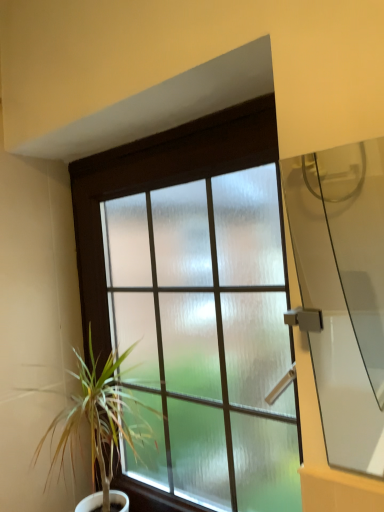
Question: Would you consider green leafy plant at left to be distant from transparent glass door at right?

Choices:
 (A) no
 (B) yes

Answer: (B)

Question: Is green leafy plant at left shorter than transparent glass door at right?

Choices:
 (A) yes
 (B) no

Answer: (B)

Question: Is transparent glass door at right surrounded by green leafy plant at left?

Choices:
 (A) no
 (B) yes

Answer: (A)

Question: From the image's perspective, does green leafy plant at left appear lower than transparent glass door at right?

Choices:
 (A) yes
 (B) no

Answer: (A)

Question: Is green leafy plant at left outside of transparent glass door at right?

Choices:
 (A) no
 (B) yes

Answer: (B)

Question: Is frosted glass window at center wider or thinner than transparent glass door at right?

Choices:
 (A) wide
 (B) thin

Answer: (A)

Question: Based on their sizes in the image, would you say frosted glass window at center is bigger or smaller than transparent glass door at right?

Choices:
 (A) big
 (B) small

Answer: (A)

Question: Considering the positions of frosted glass window at center and transparent glass door at right in the image, is frosted glass window at center taller or shorter than transparent glass door at right?

Choices:
 (A) short
 (B) tall

Answer: (B)

Question: Would you say frosted glass window at center is inside or outside transparent glass door at right?

Choices:
 (A) outside
 (B) inside

Answer: (A)

Question: Visually, is frosted glass window at center positioned to the left or to the right of green leafy plant at left?

Choices:
 (A) left
 (B) right

Answer: (B)

Question: Do you think frosted glass window at center is within green leafy plant at left, or outside of it?

Choices:
 (A) outside
 (B) inside

Answer: (A)

Question: Does point (258, 186) appear closer or farther from the camera than point (89, 434)?

Choices:
 (A) farther
 (B) closer

Answer: (B)

Question: From the image's perspective, is frosted glass window at center located above or below green leafy plant at left?

Choices:
 (A) above
 (B) below

Answer: (A)

Question: Considering the positions of green leafy plant at left and transparent glass door at right in the image, is green leafy plant at left wider or thinner than transparent glass door at right?

Choices:
 (A) wide
 (B) thin

Answer: (A)

Question: Considering the positions of point (59, 436) and point (354, 308), is point (59, 436) closer or farther from the camera than point (354, 308)?

Choices:
 (A) farther
 (B) closer

Answer: (B)